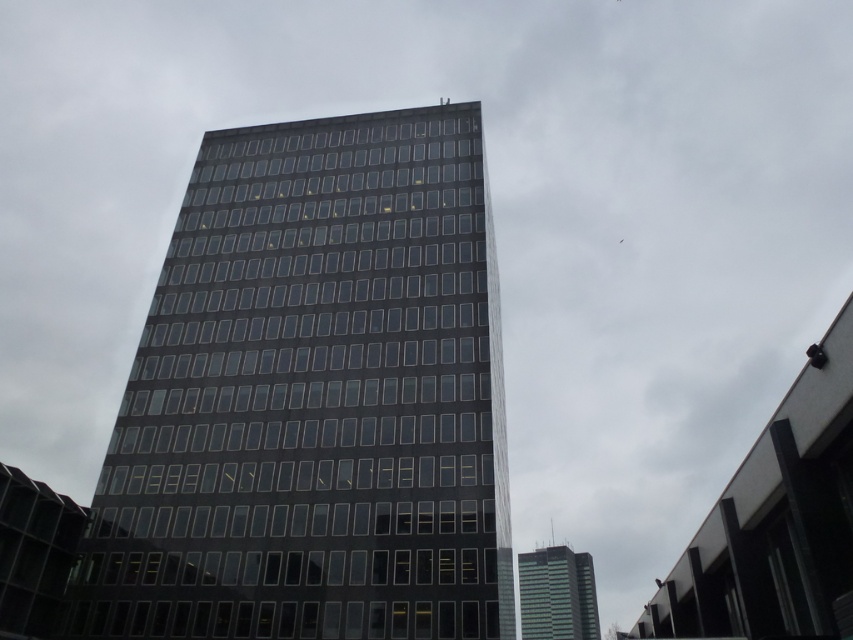
Question: From the image, what is the correct spatial relationship of black glass building at center in relation to green glass building at center?

Choices:
 (A) below
 (B) above

Answer: (B)

Question: Can you confirm if black glass building at center is bigger than green glass building at center?

Choices:
 (A) yes
 (B) no

Answer: (B)

Question: Can you confirm if black glass building at center is positioned above green glass building at center?

Choices:
 (A) yes
 (B) no

Answer: (A)

Question: Which object appears farthest from the camera in this image?

Choices:
 (A) green glass building at center
 (B) black glass building at center

Answer: (A)

Question: Among these points, which one is farthest from the camera?

Choices:
 (A) (532, 579)
 (B) (206, 452)

Answer: (A)